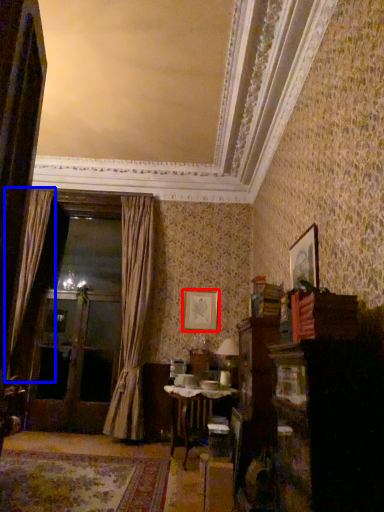
Question: Which object is further to the camera taking this photo, picture frame (highlighted by a red box) or curtain (highlighted by a blue box)?

Choices:
 (A) picture frame
 (B) curtain

Answer: (A)